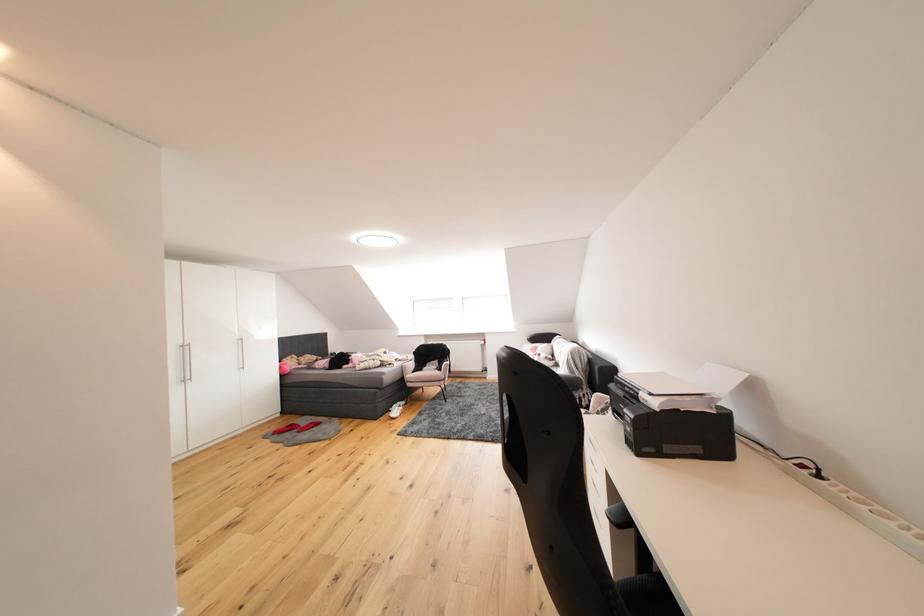
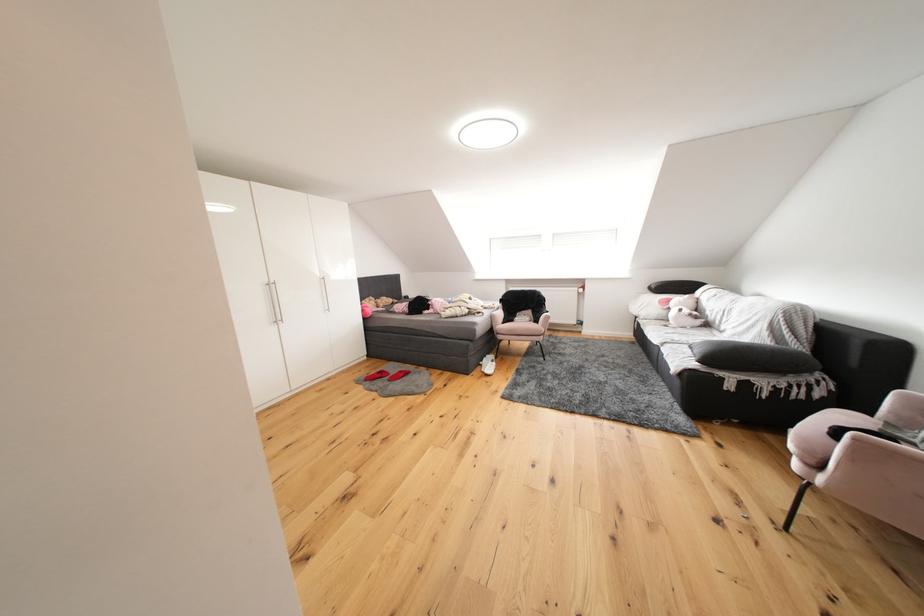
Find the pixel in the second image that matches the point at 545,352 in the first image.

(677, 305)